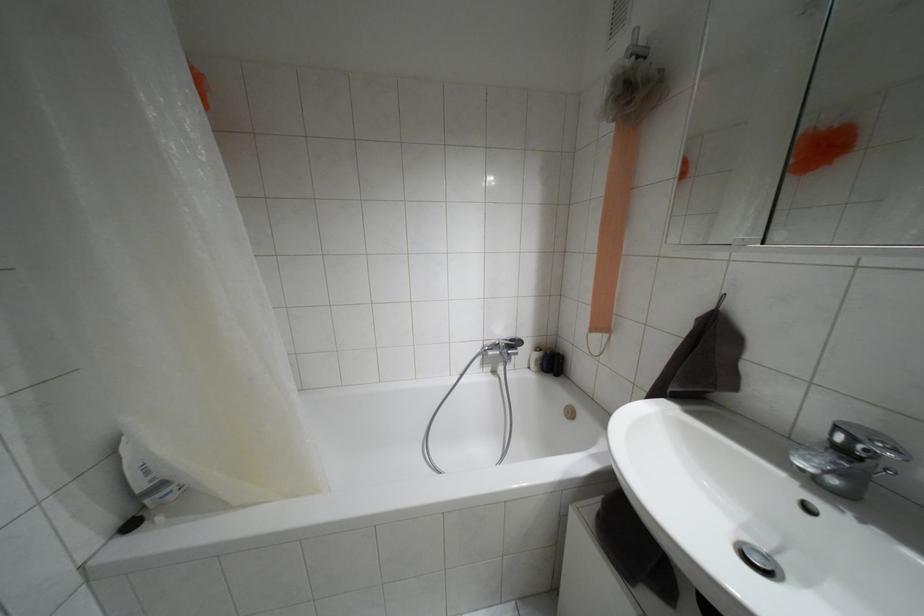
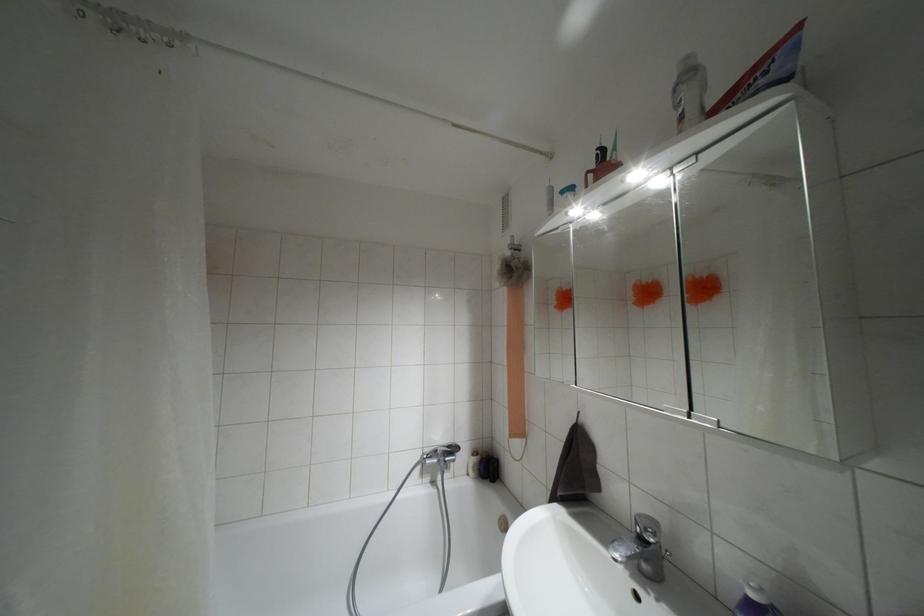
Locate, in the second image, the point that corresponds to the point at 628,102 in the first image.

(509, 277)